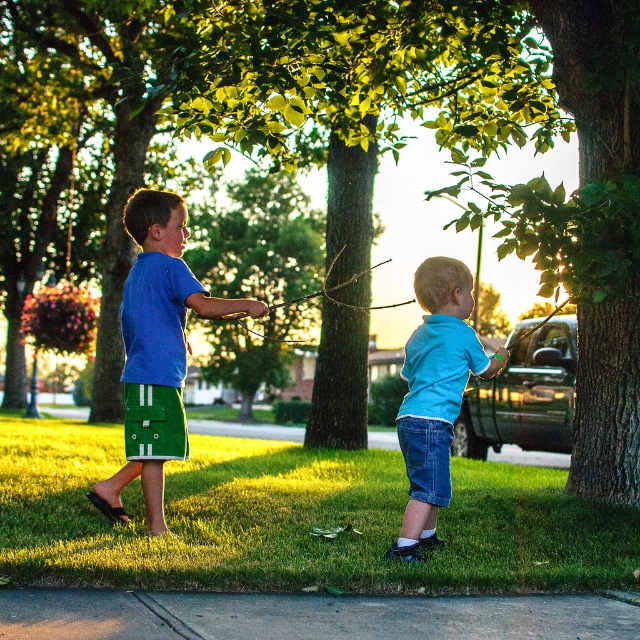
You are a delivery person trying to locate the correct house for a package. You see two children playing on the grassy area. The child on the left is wearing a blue tshirt and green shorts with white stripes, and the child on the right is in a light blue tshirt and denim shorts. There is a point marked at coordinates (589, 232). According to the image, what does this point indicate?

The point at (589, 232) indicates the location of the green rough bark tree at right.

You are a parent trying to ensure your child can reach a treehouse platform that requires a ladder. The platform is at the same height as the green rough bark tree at right. Your child is currently at the height of the blue denim shorts at lower center. Can your child reach the platform without assistance?

The green rough bark tree at right is taller than the blue denim shorts at lower center, so the platform is higher than your child. Your child cannot reach the platform without assistance.